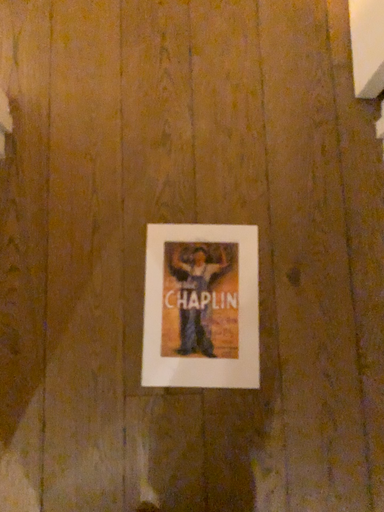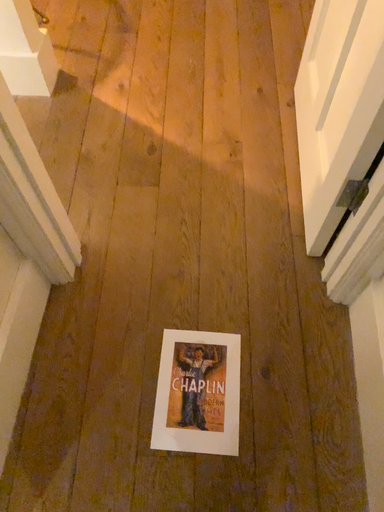
Question: How did the camera likely rotate when shooting the video?

Choices:
 (A) rotated upward
 (B) rotated downward

Answer: (A)